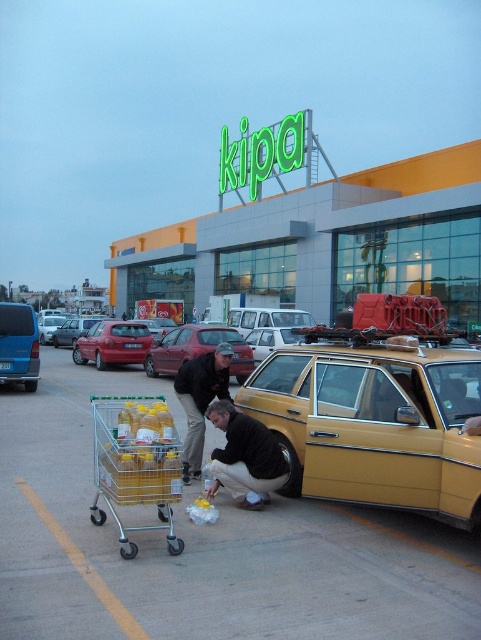
Question: Which point is closer to the camera?

Choices:
 (A) matte red sedan at left
 (B) dark brown leather jacket at center
 (C) yellow metallic taxi at center
 (D) dark brown leather jacket at lower center

Answer: (C)

Question: Is yellow car at lower right to the left of blue metallic van at left from the viewer's perspective?

Choices:
 (A) no
 (B) yes

Answer: (A)

Question: Can you confirm if metallic yellow trolley at lower left is thinner than metallic red car at left?

Choices:
 (A) yes
 (B) no

Answer: (A)

Question: Which object is closer to the camera taking this photo?

Choices:
 (A) blue metallic van at left
 (B) metallic red car at left
 (C) metallic yellow trolley at lower left
 (D) yellow car at lower right

Answer: (D)

Question: Is matte red car at center further to camera compared to matte silver sedan at center?

Choices:
 (A) no
 (B) yes

Answer: (A)

Question: Which object is farther from the camera taking this photo?

Choices:
 (A) dark brown leather jacket at lower center
 (B) matte red car at center
 (C) dark brown leather jacket at center

Answer: (B)